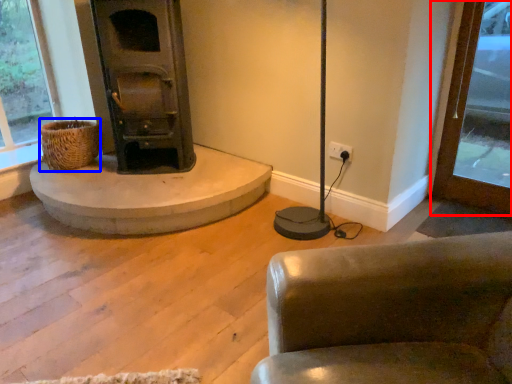
Question: Which object is further to the camera taking this photo, window frame (highlighted by a red box) or basket (highlighted by a blue box)?

Choices:
 (A) window frame
 (B) basket

Answer: (B)